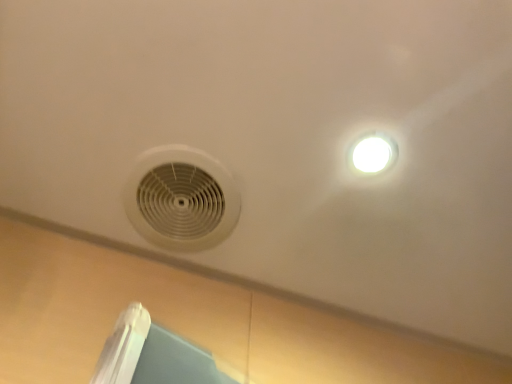
Image resolution: width=512 pixels, height=384 pixels. What do you see at coordinates (181, 199) in the screenshot?
I see `white plastic mechanical fan at upper left` at bounding box center [181, 199].

The height and width of the screenshot is (384, 512). Find the location of `white plastic mechanical fan at upper left`. white plastic mechanical fan at upper left is located at coordinates (181, 199).

What are the coordinates of `white plastic mechanical fan at upper left` in the screenshot? It's located at (181, 199).